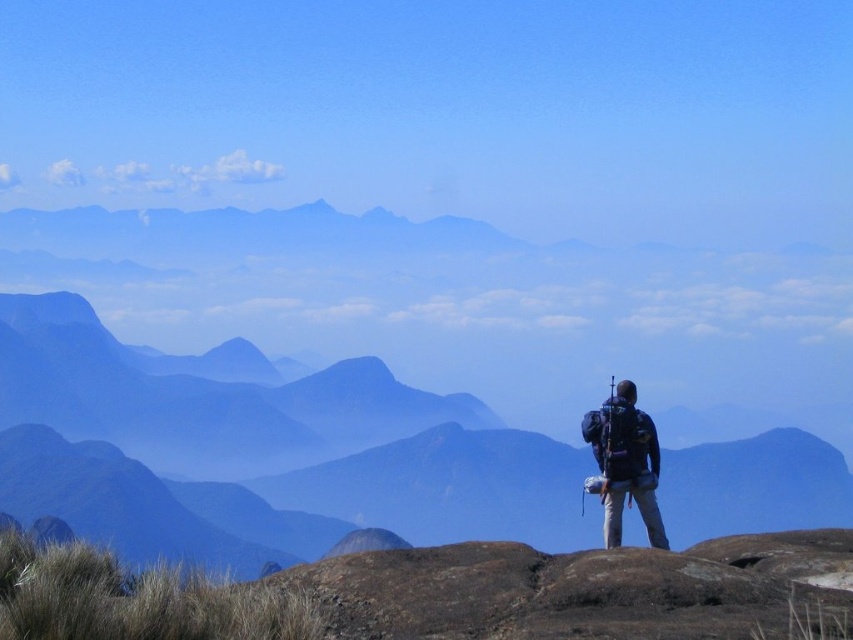
Question: Can you confirm if smooth rock mountain at center is thinner than dark blue fabric backpack at right?

Choices:
 (A) yes
 (B) no

Answer: (B)

Question: Which point is closer to the camera?

Choices:
 (A) smooth rock mountain at center
 (B) dark blue fabric backpack at right

Answer: (A)

Question: Which point is closer to the camera?

Choices:
 (A) smooth rock mountain at center
 (B) dark blue fabric backpack at right

Answer: (A)

Question: Where is smooth rock mountain at center located in relation to dark blue fabric backpack at right in the image?

Choices:
 (A) left
 (B) right

Answer: (B)

Question: Does smooth rock mountain at center have a greater width compared to dark blue fabric backpack at right?

Choices:
 (A) no
 (B) yes

Answer: (B)

Question: Which object is farther from the camera taking this photo?

Choices:
 (A) dark blue fabric backpack at right
 (B) smooth rock mountain at center

Answer: (A)